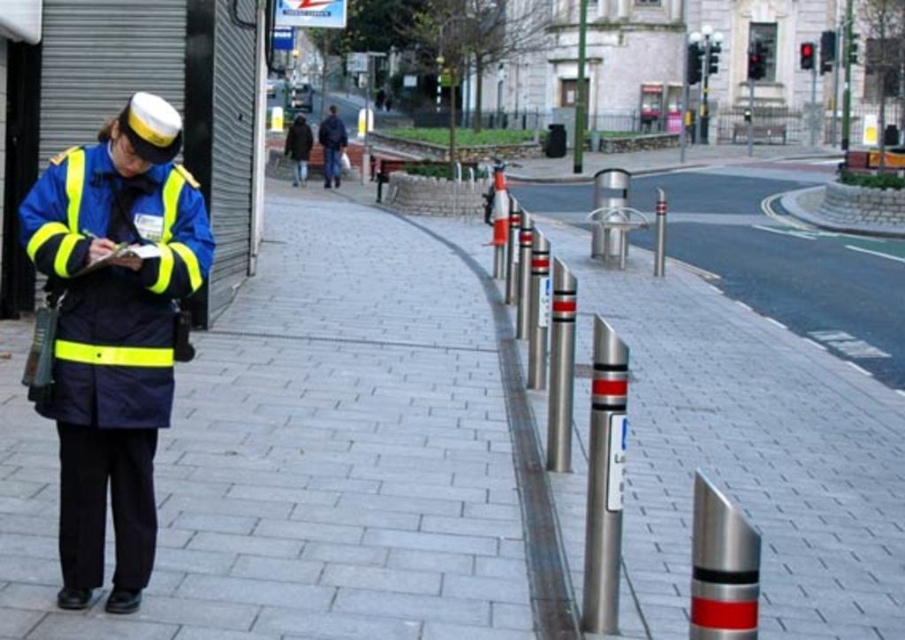
You are a delivery person trying to navigate through the urban street scene. There is a high visibility fabric uniform at left represented by point (x=113, y=332). Can you determine the location of the high visibility fabric uniform at left relative to the bollards?

The high visibility fabric uniform at left is located at point (x=113, y=332), which is to the left of the bollards.